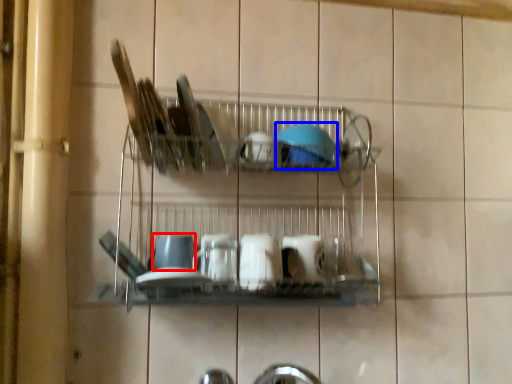
Question: Which object is further to the camera taking this photo, tableware (highlighted by a red box) or tableware (highlighted by a blue box)?

Choices:
 (A) tableware
 (B) tableware

Answer: (B)